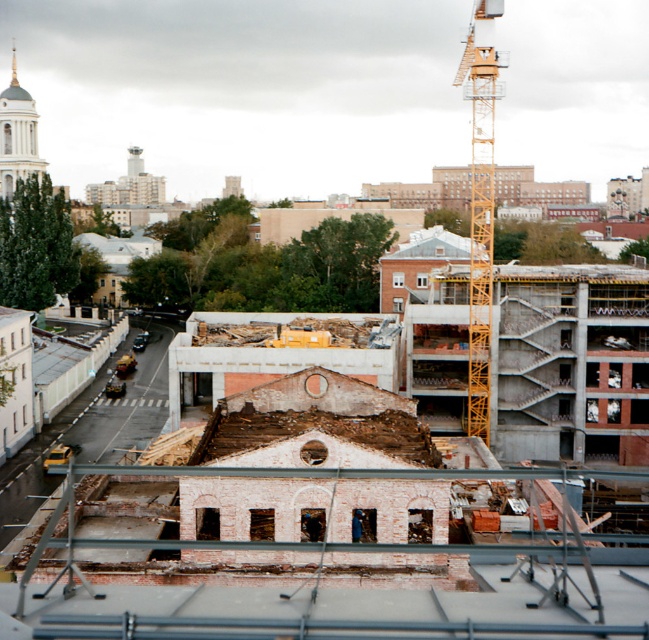
You are a delivery truck driver approaching the construction site. You need to navigate through the yellow asphalt road at lower left and around the yellow metallic crane at upper right. Which object will appear larger in your view as you approach the site?

The yellow metallic crane at upper right will appear larger in your view because it is larger than the yellow asphalt road at lower left according to the description.

You are a delivery truck driver approaching the construction site. You need to turn left onto the yellow asphalt road at lower left. Can you safely navigate around the yellow metallic crane at upper right to make this turn?

The yellow asphalt road at lower left is positioned on the left side of the yellow metallic crane at upper right, so you can safely turn left onto the yellow asphalt road at lower left without obstructing the crane.

You are a delivery truck driver who needs to navigate through the urban construction site shown in the image. You are currently positioned at the yellow metallic crane at upper right and need to reach the yellow asphalt road at lower left. Given that your truck requires a minimum clearance of 100 feet between the path and any obstacles, can you safely proceed directly to the road?

The distance between the yellow metallic crane at upper right and the yellow asphalt road at lower left is 132.80 feet, which exceeds the truck driver minimum clearance requirement of 100 feet. Therefore, it is safe to proceed directly to the road.